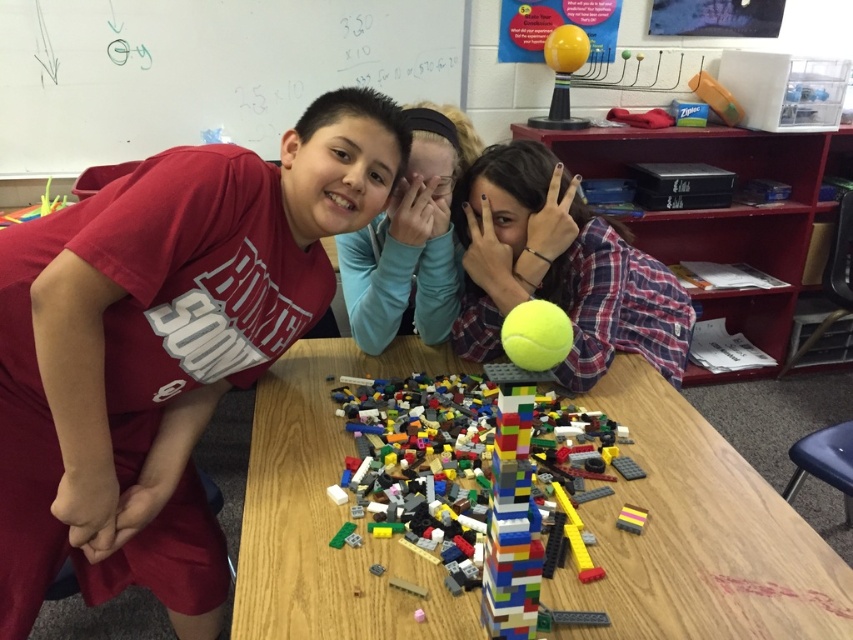
Question: From the image, what is the correct spatial relationship of matte red shirt at left in relation to yellow matte tennis ball at center?

Choices:
 (A) right
 (B) left

Answer: (B)

Question: Can you confirm if multicolored plastic blocks at center is wider than matte red shirt at upper left?

Choices:
 (A) yes
 (B) no

Answer: (A)

Question: Which of the following is the farthest from the observer?

Choices:
 (A) (42, 237)
 (B) (347, 276)
 (C) (483, 588)

Answer: (B)

Question: Can you confirm if matte red shirt at left is smaller than wooden table at center?

Choices:
 (A) yes
 (B) no

Answer: (B)

Question: Which of the following is the farthest from the observer?

Choices:
 (A) (442, 308)
 (B) (506, 540)

Answer: (A)

Question: Among these points, which one is farthest from the camera?

Choices:
 (A) (331, 394)
 (B) (650, 616)
 (C) (351, 284)
 (D) (579, 285)

Answer: (C)